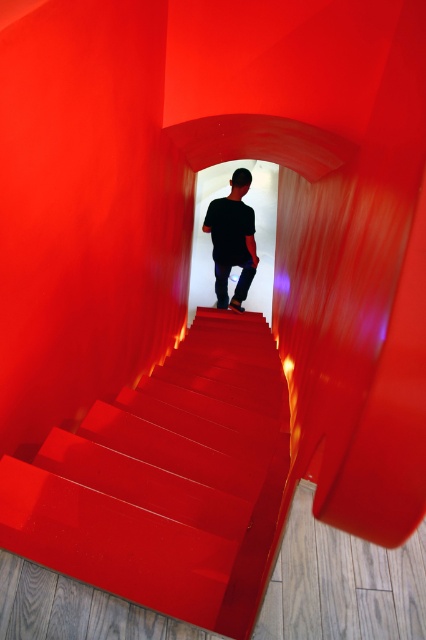
Can you confirm if glossy red stairs at center is thinner than black matte shirt at center?

In fact, glossy red stairs at center might be wider than black matte shirt at center.

Does glossy red stairs at center have a smaller size compared to black matte shirt at center?

Actually, glossy red stairs at center might be larger than black matte shirt at center.

Which is behind, point (262, 572) or point (236, 236)?

The point (236, 236) is behind.

This screenshot has width=426, height=640. I want to click on glossy red stairs at center, so click(167, 481).